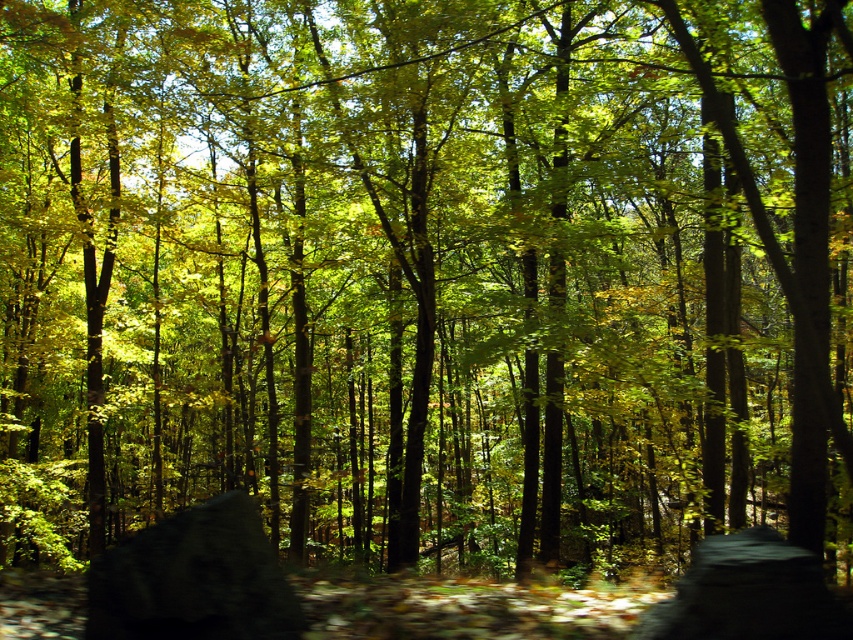
You are navigating through a forest and come across the dark gray rock at lower center. If you want to reach a point at coordinate 0.8, 0.2, would you need to go around the rock?

The dark gray rock at lower center is located at point (193, 579). Since the desired point (170, 512) is close to the rock but not exactly on it, you might need to go around the rock to reach that coordinate.

You are a hiker who wants to step onto the gray rough stone at center to avoid getting your shoes dirty. Is there a clear path to reach it without stepping on the dark gray rock at lower center?

The dark gray rock at lower center is positioned over the gray rough stone at center, so you cannot step onto the gray rough stone at center without stepping on the dark gray rock at lower center.